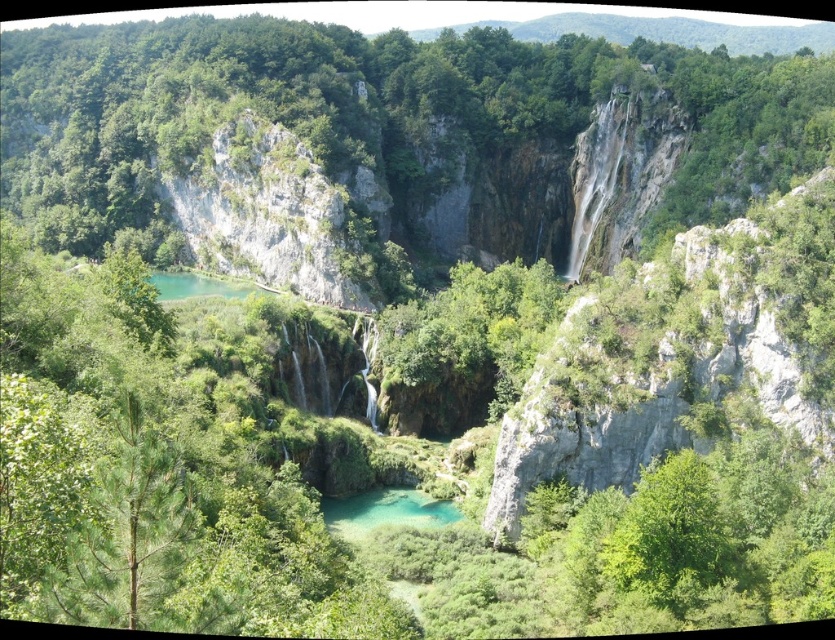
How distant is green matte tree at left from turquoise glossy water at center?

41.51 meters

Who is positioned more to the right, green matte tree at left or turquoise glossy water at center?

turquoise glossy water at center

What do you see at coordinates (129, 529) in the screenshot? This screenshot has height=640, width=835. I see `green matte tree at left` at bounding box center [129, 529].

Locate an element on the screen. Image resolution: width=835 pixels, height=640 pixels. green matte tree at left is located at coordinates (129, 529).

Looking at this image, between green leafy tree at center and turquoise glossy water at center, which one has less height?

turquoise glossy water at center

Is green leafy tree at center below turquoise glossy water at center?

Actually, green leafy tree at center is above turquoise glossy water at center.

Where is `green leafy tree at center`? This screenshot has width=835, height=640. green leafy tree at center is located at coordinates (397, 141).

Is point (491, 211) in front of point (127, 440)?

No, it is behind (127, 440).

Image resolution: width=835 pixels, height=640 pixels. What are the coordinates of `green leafy tree at center` in the screenshot? It's located at (397, 141).

Locate an element on the screen. green leafy tree at center is located at coordinates (397, 141).

Find the location of a particular element. green leafy tree at center is located at coordinates (397, 141).